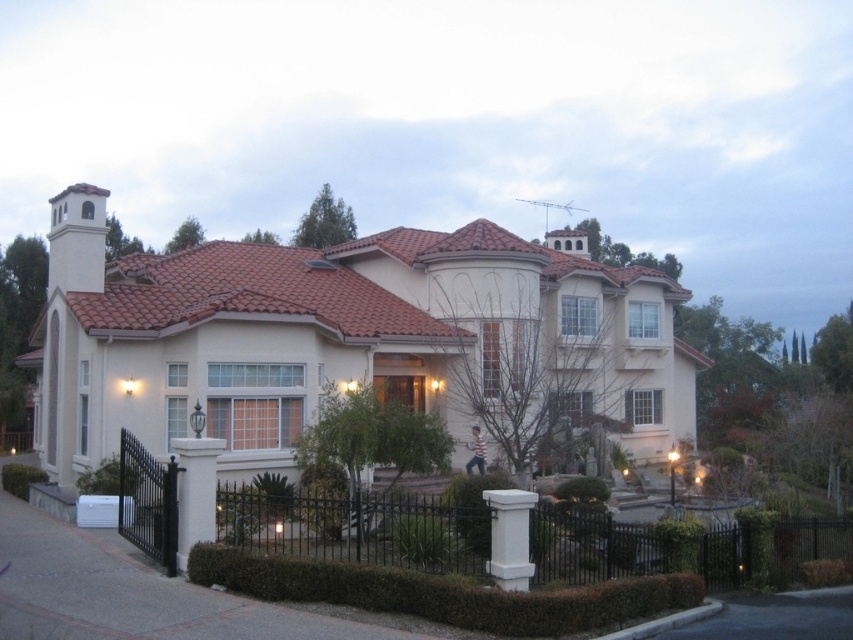
Between black wrought iron fence at lower left and white stone column at center, which one has more height?

→ black wrought iron fence at lower left is taller.

Which is below, black wrought iron fence at lower left or white stone column at center?

Positioned lower is black wrought iron fence at lower left.

Image resolution: width=853 pixels, height=640 pixels. Describe the element at coordinates (682, 547) in the screenshot. I see `black wrought iron fence at lower left` at that location.

Image resolution: width=853 pixels, height=640 pixels. What are the coordinates of `black wrought iron fence at lower left` in the screenshot? It's located at (682, 547).

Does black wrought iron fence at lower left appear on the right side of white stone pillar at lower left?

Correct, you'll find black wrought iron fence at lower left to the right of white stone pillar at lower left.

Between point (135, 497) and point (207, 470), which one is positioned behind?

The point (135, 497) is more distant.

The width and height of the screenshot is (853, 640). In order to click on black wrought iron fence at lower left in this screenshot , I will do `click(682, 547)`.

How much distance is there between white stone pillar at lower left and white stone column at center?

white stone pillar at lower left and white stone column at center are 13.90 feet apart from each other.

In the scene shown: Can you confirm if white stone pillar at lower left is wider than white stone column at center?

Yes.

Does point (184, 480) come behind point (520, 545)?

Yes, point (184, 480) is behind point (520, 545).

Locate an element on the screen. white stone pillar at lower left is located at coordinates (195, 492).